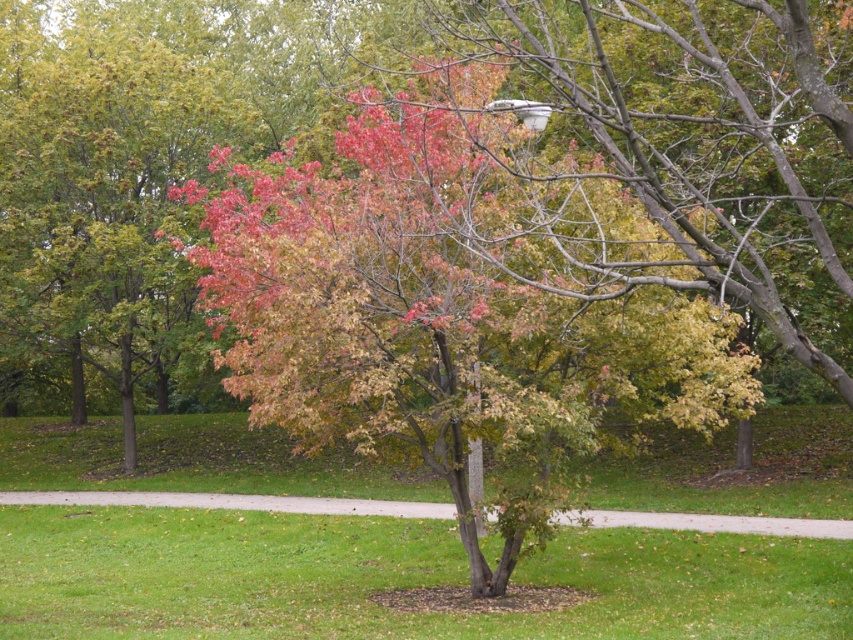
Question: Considering the real-world distances, which object is closest to the green grass at center?

Choices:
 (A) concrete sidewalk at center
 (B) multicolored foliage at center

Answer: (A)

Question: Among these objects, which one is farthest from the camera?

Choices:
 (A) multicolored foliage at center
 (B) concrete sidewalk at center
 (C) green grass at center

Answer: (B)

Question: Considering the relative positions of multicolored foliage at center and green grass at center in the image provided, where is multicolored foliage at center located with respect to green grass at center?

Choices:
 (A) below
 (B) above

Answer: (B)

Question: Does green grass at center come in front of concrete sidewalk at center?

Choices:
 (A) no
 (B) yes

Answer: (B)

Question: Which of these objects is positioned farthest from the green grass at center?

Choices:
 (A) concrete sidewalk at center
 (B) multicolored foliage at center

Answer: (B)

Question: Is multicolored foliage at center thinner than concrete sidewalk at center?

Choices:
 (A) yes
 (B) no

Answer: (A)